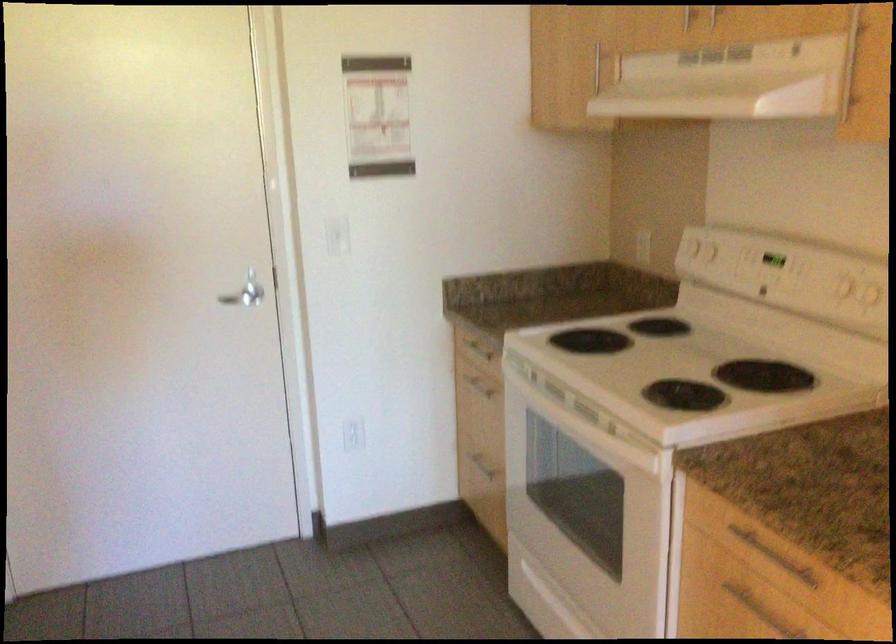
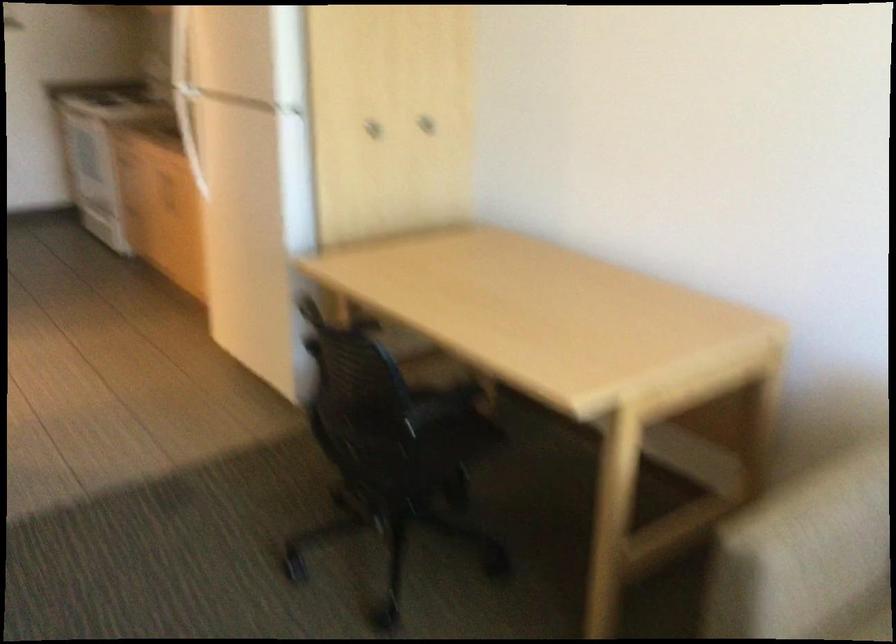
Question: I am providing you with two images of the same scene from different viewpoints. After the viewpoint changes to image2, which objects are now occluded?

Choices:
 (A) drawer handle
 (B) refrigerator door handle
 (C) chair sitting surface
 (D) large cloth bag

Answer: (A)